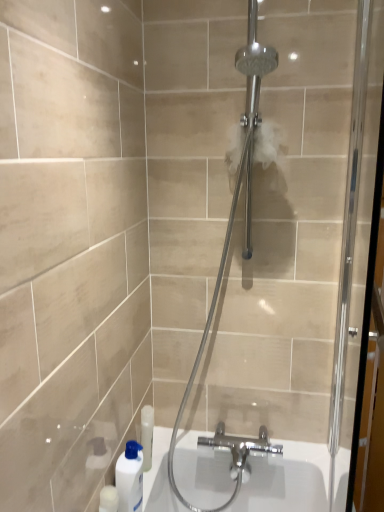
Question: In terms of height, does clear glass shower door at center look taller or shorter compared to white glossy bottle at lower left?

Choices:
 (A) tall
 (B) short

Answer: (A)

Question: Is clear glass shower door at center wider or thinner than white glossy bottle at lower left?

Choices:
 (A) wide
 (B) thin

Answer: (A)

Question: Which is farther from the clear glass shower door at center?

Choices:
 (A) white glossy bottle at lower left
 (B) clear glass screen door at right

Answer: (A)

Question: Which is nearer to the clear glass shower door at center?

Choices:
 (A) white glossy bottle at lower left
 (B) clear glass screen door at right

Answer: (B)